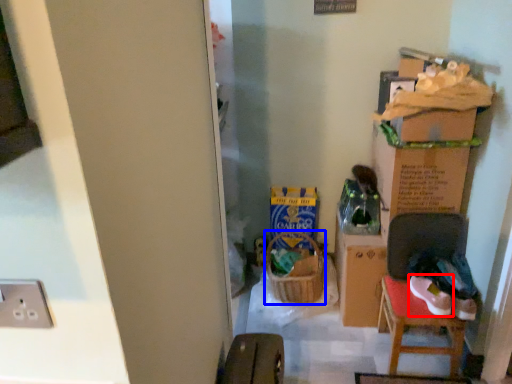
Question: Which object appears farthest to the camera in this image, footwear (highlighted by a red box) or laundry basket (highlighted by a blue box)?

Choices:
 (A) footwear
 (B) laundry basket

Answer: (B)